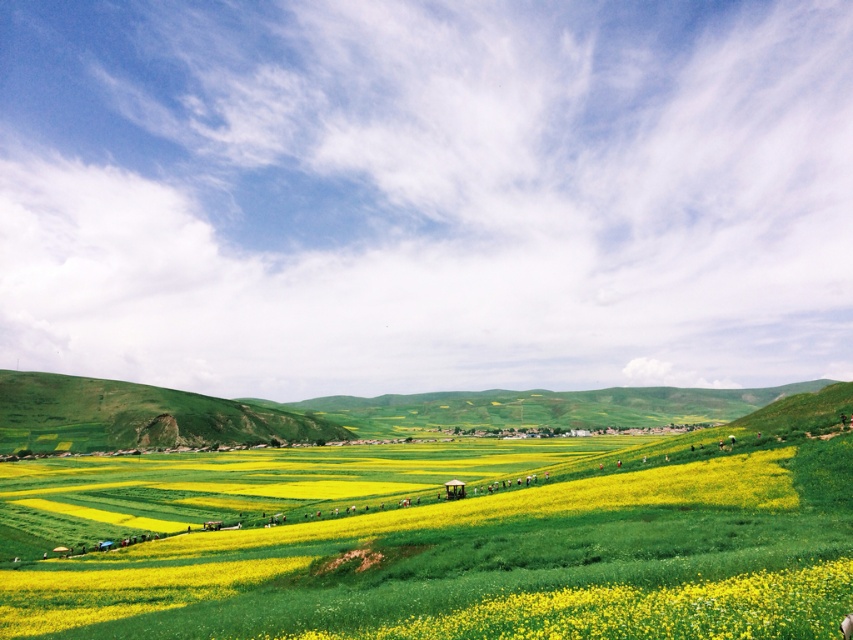
You are a landscape photographer planning to capture the yellow matte flower at center and the green grassy hillside at left in a single frame. Based on their heights, which object would appear smaller in the photo?

The yellow matte flower at center appears smaller in the photo because it has a lesser height compared to the green grassy hillside at left.

You are a photographer standing at the edge of the yellow matte flower at center. You want to take a photo of the gazebo or pavilion in the middle ground. Which direction should you move to frame the gazebo or pavilion properly?

Since the yellow matte flower at center is located at point 0.955 on the x and 0.756 on the y axis, you should move to the left to frame the gazebo or pavilion properly as it is centrally positioned in the middle ground.

Looking at this image, you are a landscape architect planning to install a new walking path between the yellow matte flower at center and the green grassy hillside at left. Given that the path must be exactly 350 meters long, will the path reach the hillside from the flower field?

The distance between the yellow matte flower at center and the green grassy hillside at left is 363.20 meters. Since the path is only 350 meters long, it will not reach the hillside from the flower field.